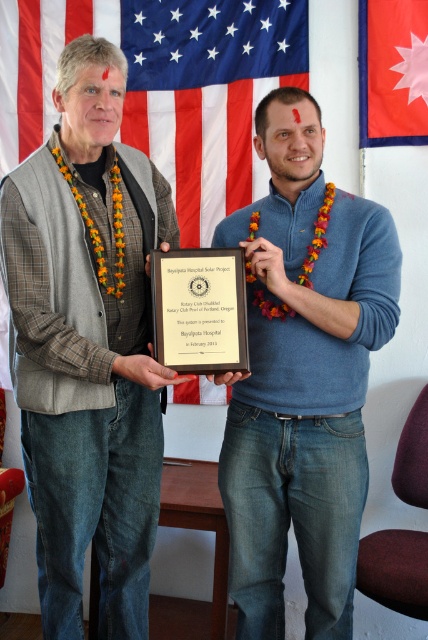
You are a photographer standing 1.8 meters away from the camera. You want to take a photo of the blue matte sweater at center. Is the sweater within your camera range?

A: The blue matte sweater at center is 1.55 meters away from the camera, so yes, it is within the photographer standing 1.8 meters away from the camera range. The sweater is closer to the camera than the photographer, so it should be in frame.

Based on the scene description, can you determine the position of the matte black plaque at center relative to the nepali flag at upper right?

The matte black plaque at center is to the left of the nepali flag at upper right.

What object is located at the coordinates point (163, 86) in the scene?

The point (163, 86) corresponds to the american flag at upper center.